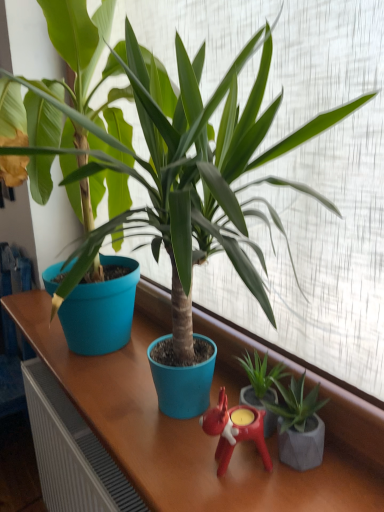
Question: Could you tell me if matte blue pot at center, which ranks as the first houseplant in left-to-right order, is turned towards rubberized red candle holder at center?

Choices:
 (A) yes
 (B) no

Answer: (B)

Question: Is rubberized red candle holder at center completely or partially inside matte blue pot at center, which ranks as the first houseplant in left-to-right order?

Choices:
 (A) yes
 (B) no

Answer: (B)

Question: From the image's perspective, is matte blue pot at center, which ranks as the first houseplant in left-to-right order, on rubberized red candle holder at center?

Choices:
 (A) yes
 (B) no

Answer: (A)

Question: Is matte blue pot at center, the third houseplant viewed from the right, not inside rubberized red candle holder at center?

Choices:
 (A) no
 (B) yes

Answer: (B)

Question: From a real-world perspective, is matte blue pot at center, the third houseplant viewed from the right, positioned over rubberized red candle holder at center based on gravity?

Choices:
 (A) yes
 (B) no

Answer: (A)

Question: Are matte blue pot at center, which ranks as the first houseplant in left-to-right order, and rubberized red candle holder at center located far from each other?

Choices:
 (A) no
 (B) yes

Answer: (A)

Question: Is green matte plant at center, the 2th houseplant in the right-to-left sequence, in contact with matte blue pot at center, the third houseplant viewed from the right?

Choices:
 (A) yes
 (B) no

Answer: (B)

Question: From the image's perspective, does green matte plant at center, the 2th houseplant in the right-to-left sequence, appear lower than matte blue pot at center, which ranks as the first houseplant in left-to-right order?

Choices:
 (A) no
 (B) yes

Answer: (B)

Question: From a real-world perspective, does green matte plant at center, the 2th houseplant in the right-to-left sequence, stand above matte blue pot at center, the third houseplant viewed from the right?

Choices:
 (A) no
 (B) yes

Answer: (A)

Question: Is green matte plant at center, the 2th houseplant in the right-to-left sequence, not inside matte blue pot at center, the third houseplant viewed from the right?

Choices:
 (A) no
 (B) yes

Answer: (B)

Question: Is green matte plant at center, which is counted as the second houseplant, starting from the left, closer to the viewer compared to matte blue pot at center, the third houseplant viewed from the right?

Choices:
 (A) no
 (B) yes

Answer: (A)

Question: Considering the relative sizes of green matte plant at center, the 2th houseplant in the right-to-left sequence, and matte blue pot at center, which ranks as the first houseplant in left-to-right order, in the image provided, is green matte plant at center, the 2th houseplant in the right-to-left sequence, smaller than matte blue pot at center, which ranks as the first houseplant in left-to-right order,?

Choices:
 (A) yes
 (B) no

Answer: (A)

Question: Does green matte plant at center, the 2th houseplant in the right-to-left sequence, turn towards rubberized red candle holder at center?

Choices:
 (A) no
 (B) yes

Answer: (B)